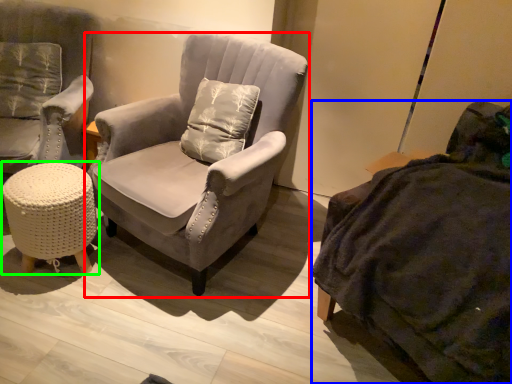
Question: Estimate the real-world distances between objects in this image. Which object is farther from chair (highlighted by a red box), studio couch (highlighted by a blue box) or table (highlighted by a green box)?

Choices:
 (A) studio couch
 (B) table

Answer: (A)